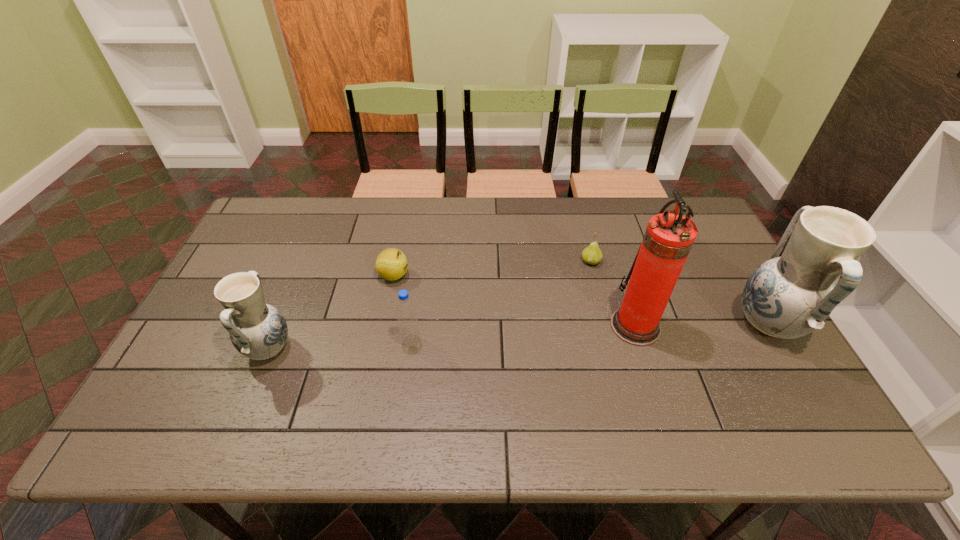
Image resolution: width=960 pixels, height=540 pixels. In order to click on free space between the pear and the fifth object from right to left in this screenshot , I will do `click(492, 268)`.

Locate an element on the screen. vacant point located between the tallest object and the pear is located at coordinates (613, 293).

At what (x,y) coordinates should I click in order to perform the action: click on vacant space in between the pear and the shorter pottery. Please return your answer as a coordinate pair (x, y). The width and height of the screenshot is (960, 540). Looking at the image, I should click on (430, 305).

You are a GUI agent. You are given a task and a screenshot of the screen. Output one action in this format:
    pyautogui.click(x=<x>, y=<y>)
    Task: Click on the free space that is in between the right pottery and the fourth shortest object
    This screenshot has height=540, width=960.
    Given the screenshot: What is the action you would take?
    pyautogui.click(x=518, y=337)

Image resolution: width=960 pixels, height=540 pixels. I want to click on vacant space that is in between the water bottle and the shorter pottery, so click(x=340, y=345).

Where is `free space between the pear and the fourth object from right to left`? The width and height of the screenshot is (960, 540). free space between the pear and the fourth object from right to left is located at coordinates (501, 301).

The width and height of the screenshot is (960, 540). I want to click on free space that is in between the fifth shortest object and the second object from left to right, so [581, 301].

At what (x,y) coordinates should I click in order to perform the action: click on vacant space that's between the third object from left to right and the fire extinguisher. Please return your answer as a coordinate pair (x, y). The height and width of the screenshot is (540, 960). Looking at the image, I should click on (523, 333).

Where is `the fifth closest object to the water bottle`? the fifth closest object to the water bottle is located at coordinates (x=792, y=294).

At what (x,y) coordinates should I click in order to perform the action: click on object that is the fifth closest to the pear. Please return your answer as a coordinate pair (x, y). Image resolution: width=960 pixels, height=540 pixels. Looking at the image, I should click on point(257,330).